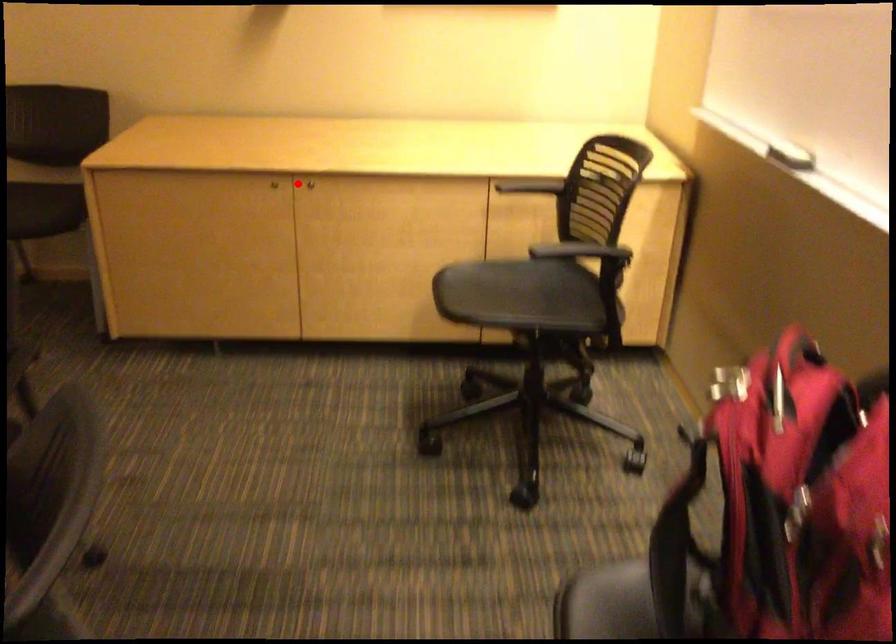
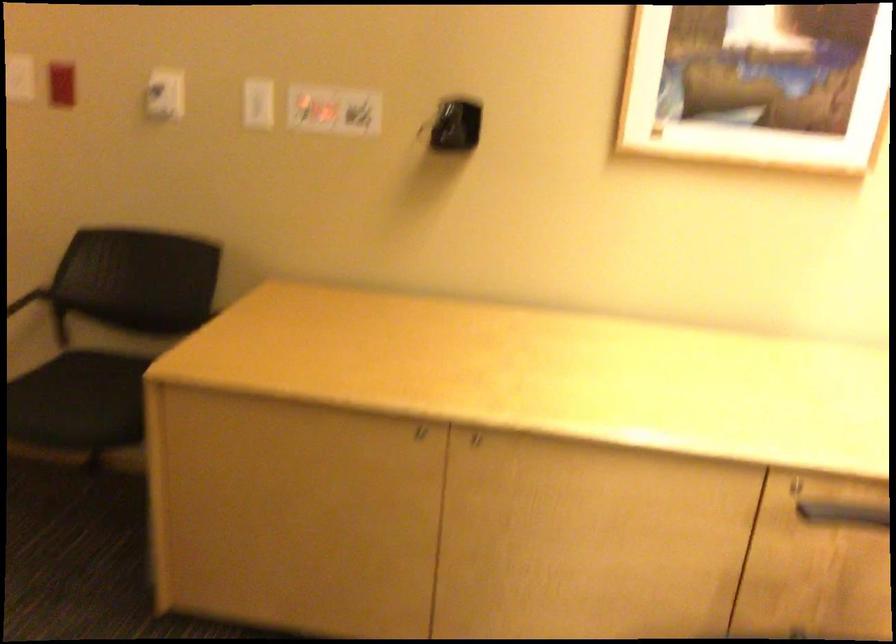
Find the pixel in the second image that matches the highlighted location in the first image.

(472, 437)